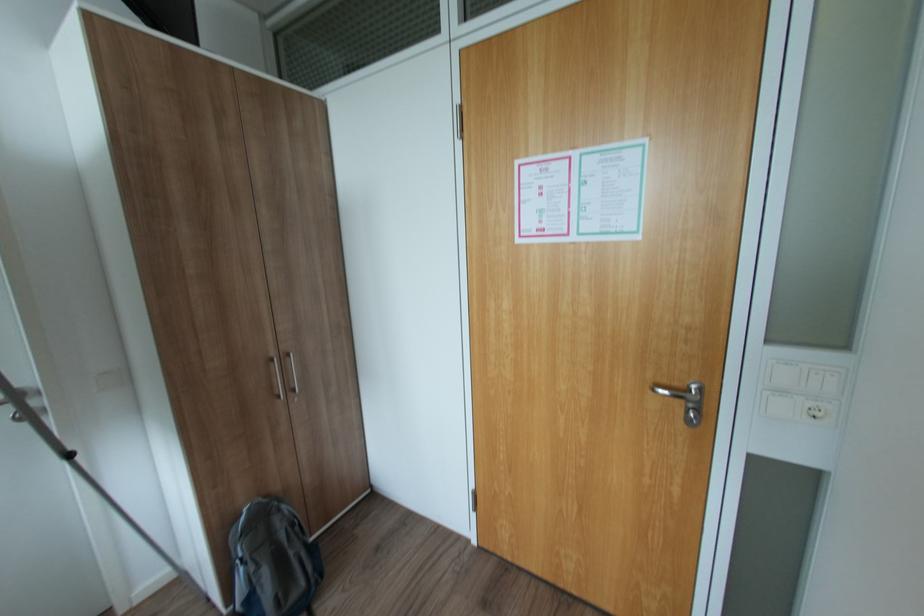
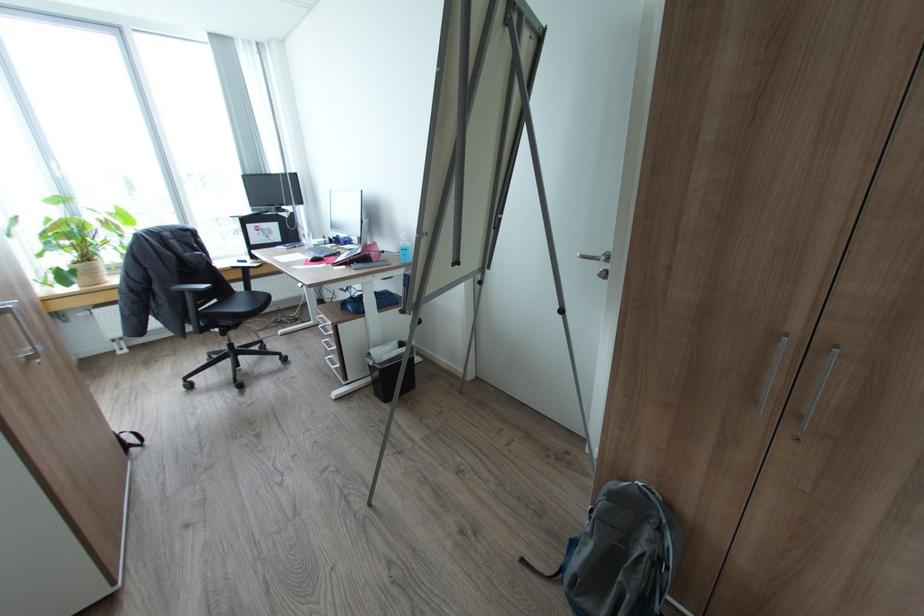
First-person continuous shooting, in which direction is the camera rotating?

The camera's rotation is toward left-down.